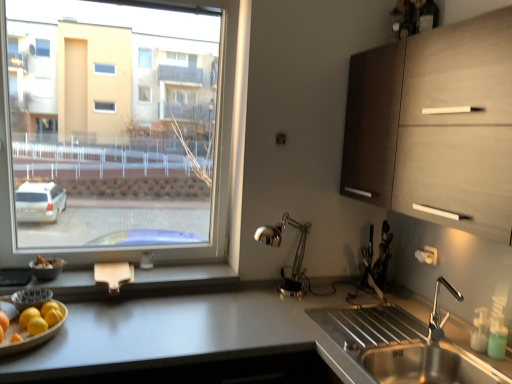
Question: Is wooden tray with fruits at lower left inside or outside of matte black bowl at lower left?

Choices:
 (A) outside
 (B) inside

Answer: (A)

Question: From the image's perspective, is wooden tray with fruits at lower left located above or below matte black bowl at lower left?

Choices:
 (A) below
 (B) above

Answer: (A)

Question: Estimate the real-world distances between objects in this image. Which object is farther from the green translucent soap dispenser at lower right?

Choices:
 (A) matte black bowl at lower left
 (B) wooden tray with fruits at lower left
 (C) wooden at lower left
 (D) matte wood cabinet at upper right
 (E) stainless steel sink at lower right

Answer: (A)

Question: Which object is the closest to the matte wood cabinet at upper right?

Choices:
 (A) white glossy countertop at lower left
 (B) matte black bowl at lower left
 (C) green translucent soap dispenser at lower right
 (D) wooden tray with fruits at lower left
 (E) stainless steel sink at lower right

Answer: (E)